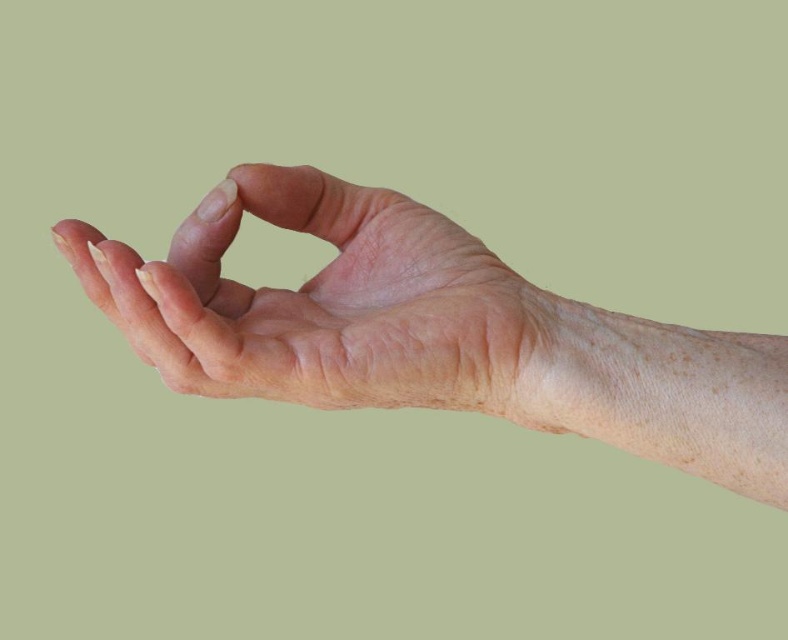
Question: Is dry skin hand at center wider than smooth skin hand at center?

Choices:
 (A) yes
 (B) no

Answer: (A)

Question: Does dry skin hand at center come behind smooth skin hand at center?

Choices:
 (A) no
 (B) yes

Answer: (A)

Question: Among these points, which one is farthest from the camera?

Choices:
 (A) (229, 241)
 (B) (441, 365)

Answer: (A)

Question: Is dry skin hand at center positioned at the back of smooth skin hand at center?

Choices:
 (A) no
 (B) yes

Answer: (A)

Question: Which point is farther from the camera taking this photo?

Choices:
 (A) (171, 260)
 (B) (162, 289)

Answer: (A)